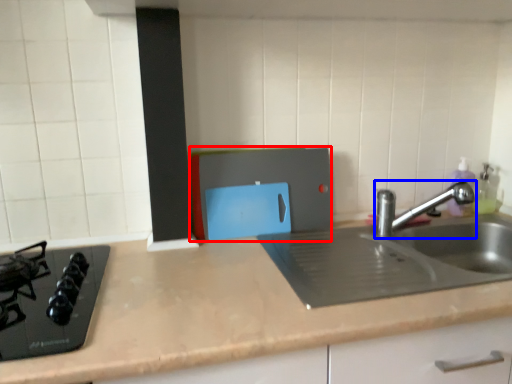
Question: Which object is closer to the camera taking this photo, appliance (highlighted by a red box) or tap (highlighted by a blue box)?

Choices:
 (A) appliance
 (B) tap

Answer: (B)